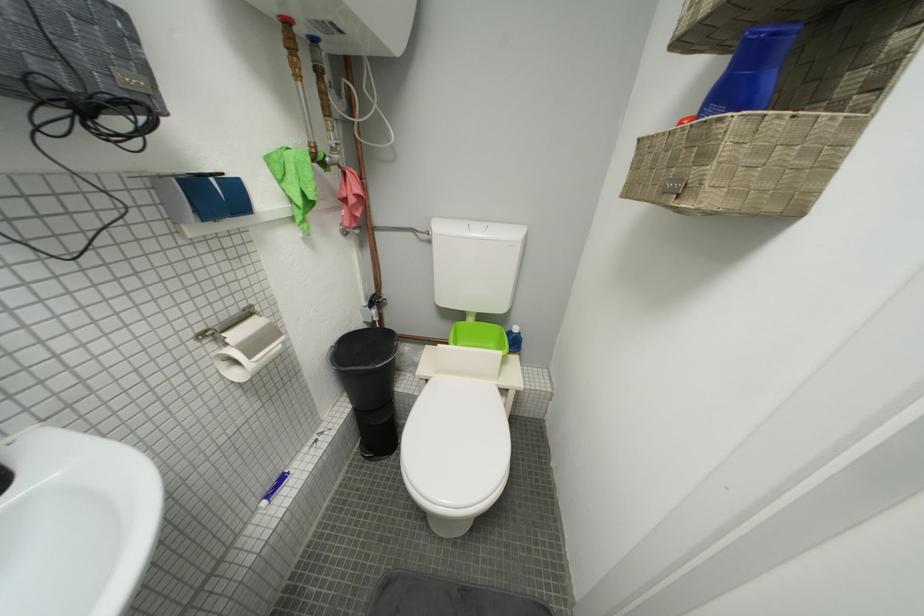
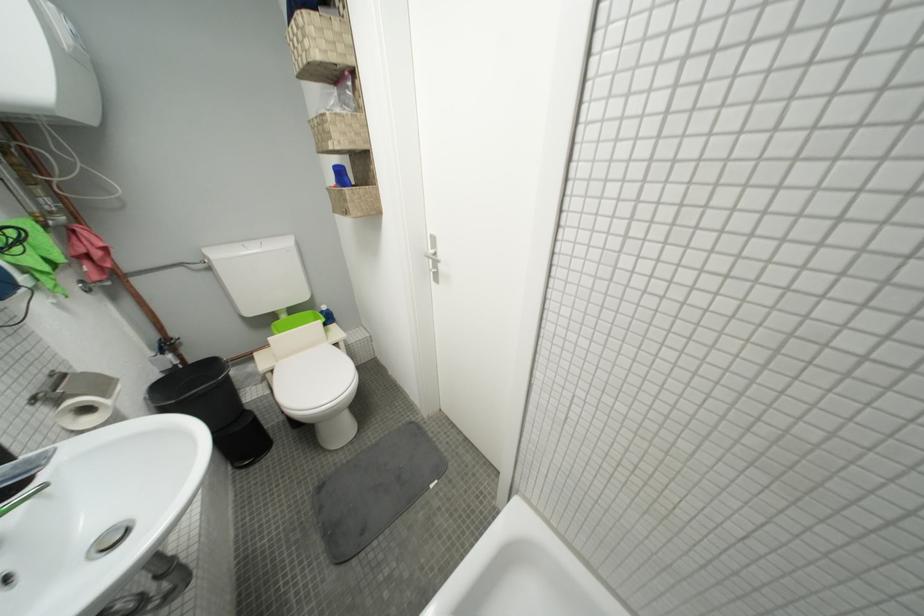
Question: I am providing you with two images of the same scene from different viewpoints. Which of the following objects are not visible in image2?

Choices:
 (A) blue plastic cup
 (B) blue plastic bottle
 (C) toilet flush button
 (D) none of these

Answer: (D)